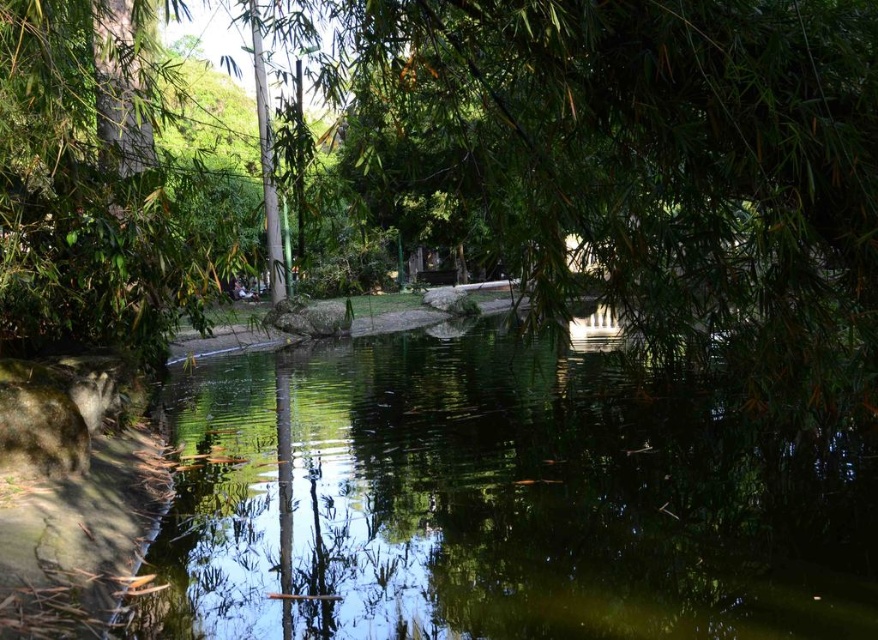
Is green leafy tree at center positioned at the back of green reflective water at center?

Yes, it is behind green reflective water at center.

Does green leafy tree at center appear under green reflective water at center?

No, green leafy tree at center is not below green reflective water at center.

Does point (594, 48) come farther from viewer compared to point (451, 323)?

No, it is not.

You are a GUI agent. You are given a task and a screenshot of the screen. Output one action in this format:
    pyautogui.click(x=<x>, y=<y>)
    Task: Click on the green leafy tree at center
    The height and width of the screenshot is (640, 878).
    Given the screenshot: What is the action you would take?
    pyautogui.click(x=646, y=163)